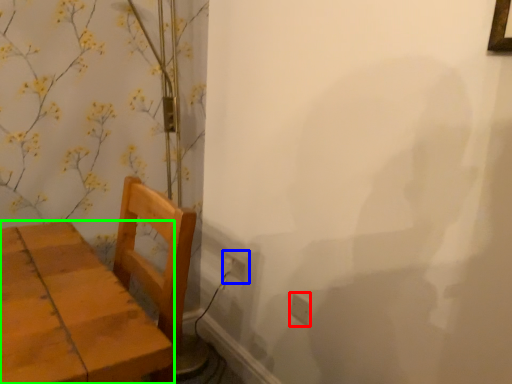
Question: Considering the real-world distances, which object is closest to electric outlet (highlighted by a red box)? electric outlet (highlighted by a blue box) or furniture (highlighted by a green box).

Choices:
 (A) electric outlet
 (B) furniture

Answer: (A)